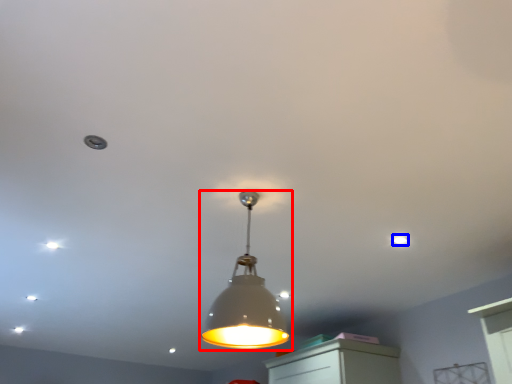
Question: Which of the following is the closest to the observer, lamp (highlighted by a red box) or dot (highlighted by a blue box)?

Choices:
 (A) lamp
 (B) dot

Answer: (A)